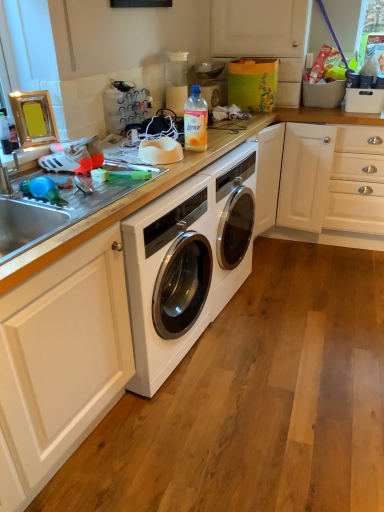
Question: Would you say translucent plastic bottle at center is to the left or to the right of matte white cabinet at upper right in the picture?

Choices:
 (A) right
 (B) left

Answer: (B)

Question: Is point (205, 148) closer or farther from the camera than point (259, 33)?

Choices:
 (A) farther
 (B) closer

Answer: (B)

Question: Which is nearer to the matte white cabinet at upper right?

Choices:
 (A) white glossy countertop at center
 (B) translucent plastic bottle at center

Answer: (A)

Question: Estimate the real-world distances between objects in this image. Which object is closer to the translucent plastic bottle at center?

Choices:
 (A) matte white cabinet at upper right
 (B) white glossy countertop at center

Answer: (B)